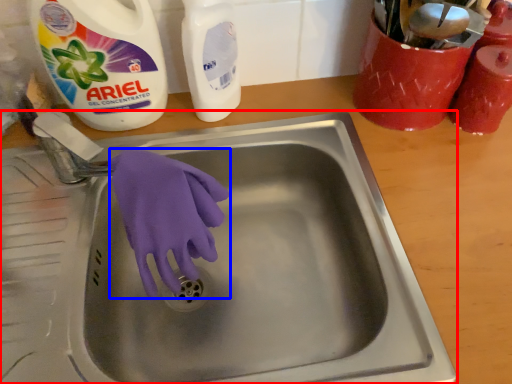
Question: Among these objects, which one is nearest to the camera, sink (highlighted by a red box) or glove (highlighted by a blue box)?

Choices:
 (A) sink
 (B) glove

Answer: (A)